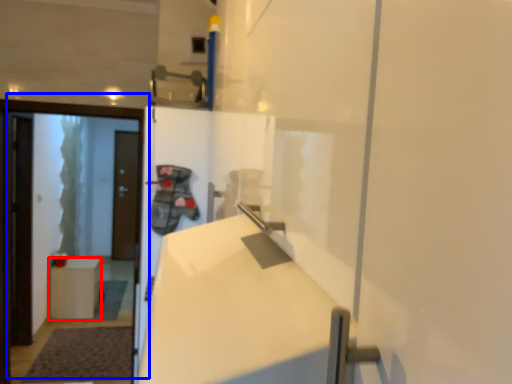
Question: Which object appears closest to the camera in this image, furniture (highlighted by a red box) or door (highlighted by a blue box)?

Choices:
 (A) furniture
 (B) door

Answer: (B)